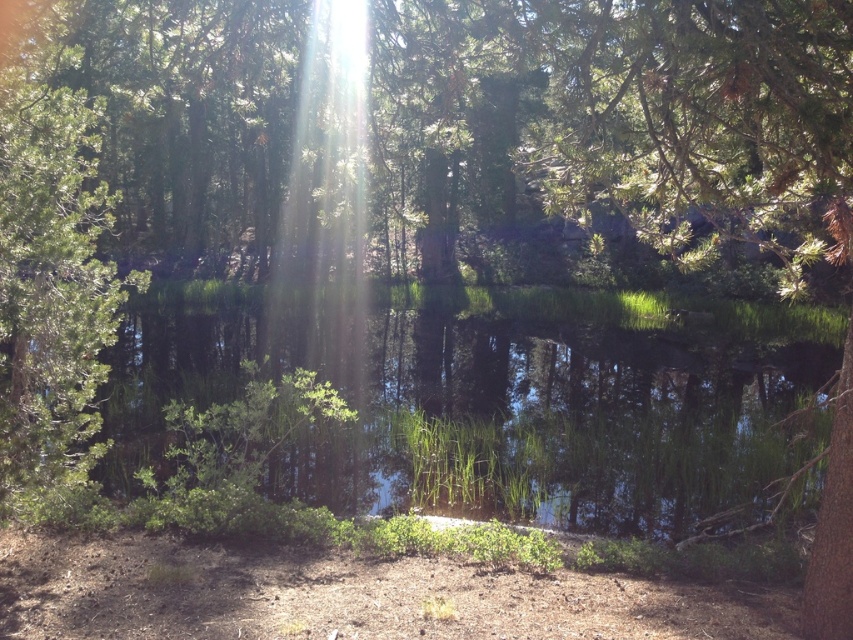
Question: In this image, where is green matte tree at upper center located relative to green reflective water at center?

Choices:
 (A) above
 (B) below

Answer: (A)

Question: Which object is closer to the camera taking this photo?

Choices:
 (A) green matte tree at upper center
 (B) green reflective water at center

Answer: (A)

Question: Among these objects, which one is farthest from the camera?

Choices:
 (A) green matte tree at upper center
 (B) green reflective water at center

Answer: (B)

Question: Is green matte tree at upper center smaller than green reflective water at center?

Choices:
 (A) yes
 (B) no

Answer: (B)

Question: Does green matte tree at upper center appear on the right side of green reflective water at center?

Choices:
 (A) yes
 (B) no

Answer: (A)

Question: Among these objects, which one is nearest to the camera?

Choices:
 (A) green reflective water at center
 (B) green matte tree at upper center

Answer: (B)